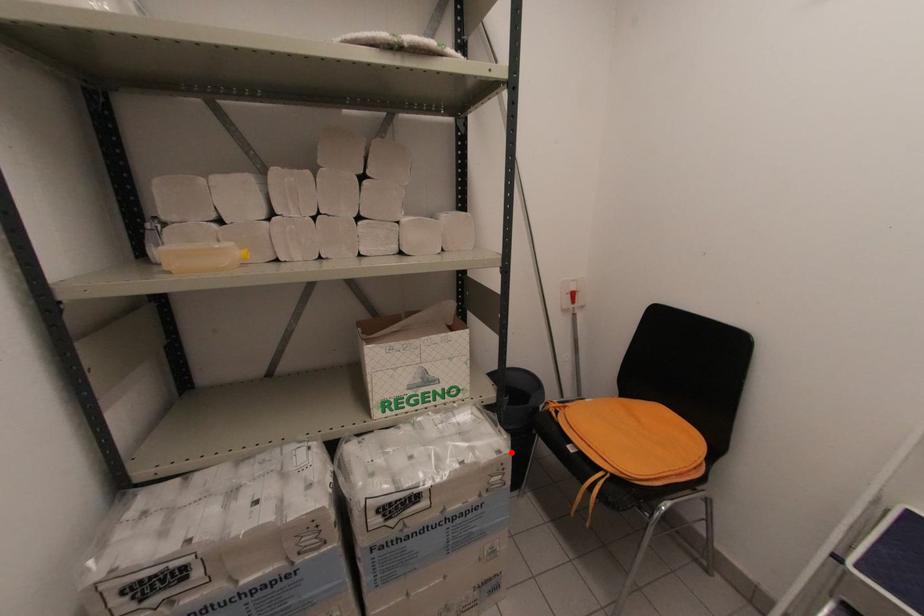
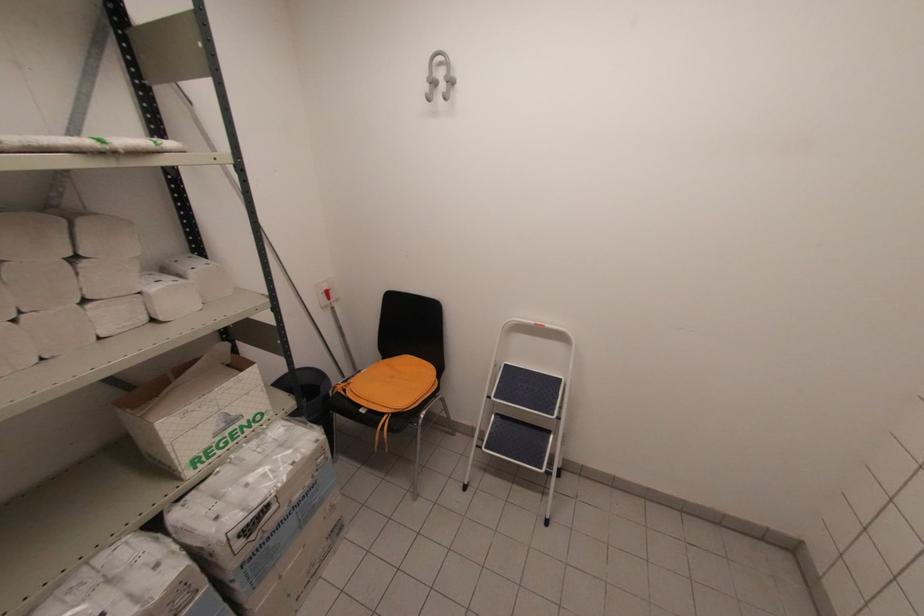
Where in the second image is the point corresponding to the highlighted location from the first image?

(325, 437)